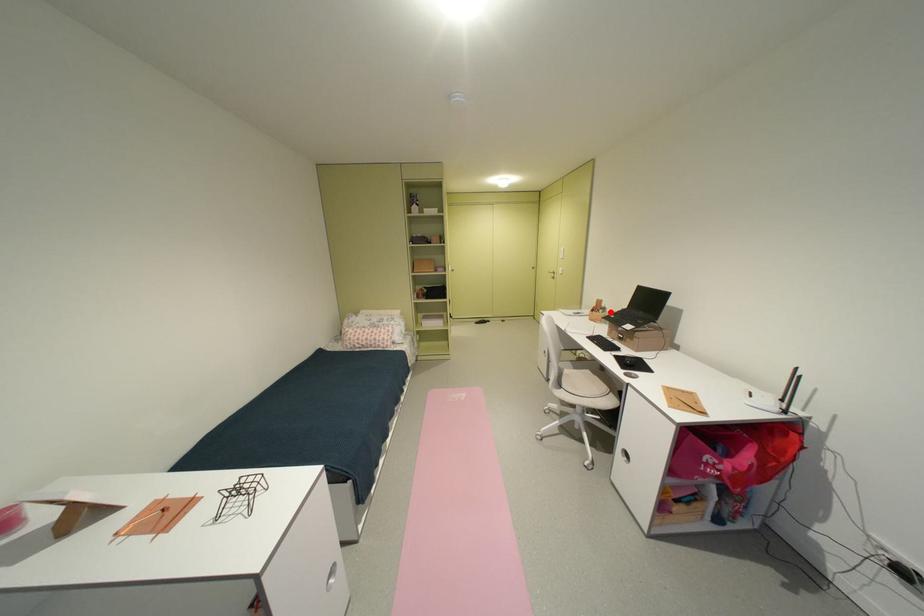
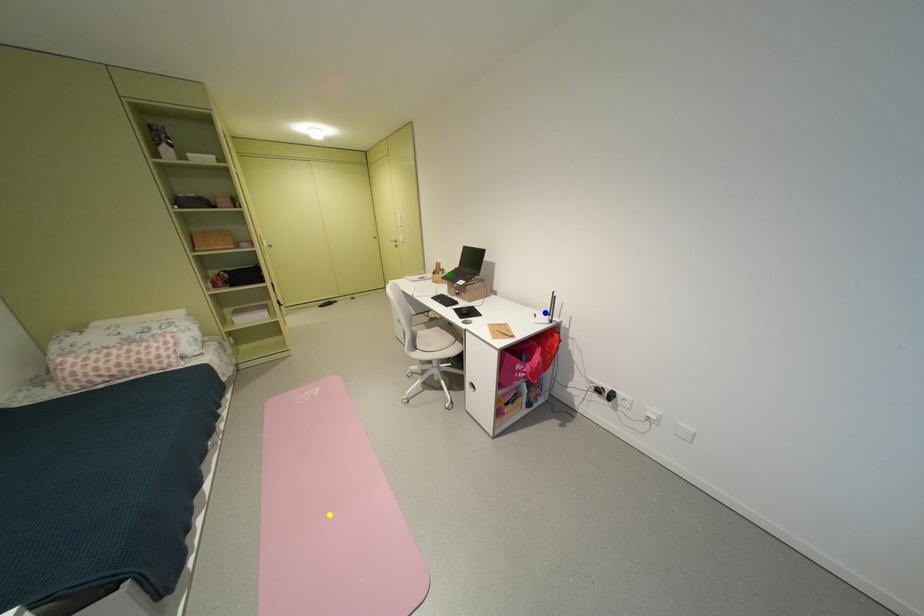
Question: I am providing you with two images of the same scene from different viewpoints. A red point is marked on the first image. You are given multiple points on the second image. Which spot in image 2 lines up with the point in image 1?

Choices:
 (A) green point
 (B) blue point
 (C) yellow point

Answer: (A)